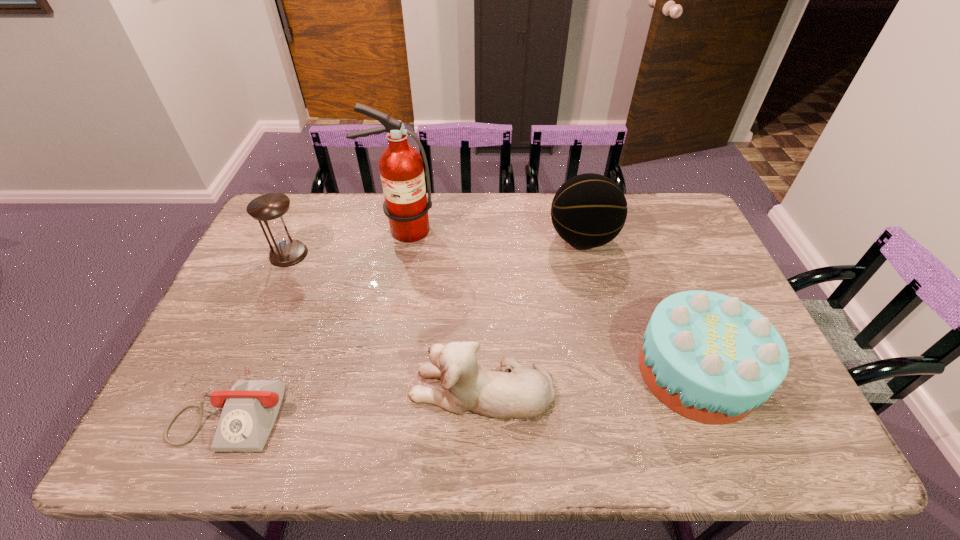
Identify the location of vacant space located on the front-facing side of the puppy. (248, 389).

You are a GUI agent. You are given a task and a screenshot of the screen. Output one action in this format:
    pyautogui.click(x=<x>, y=<y>)
    Task: Click on the free space located 0.050m on the front-facing side of the puppy
    
    Given the screenshot: What is the action you would take?
    coord(389,389)

The width and height of the screenshot is (960, 540). What are the coordinates of `vacant area situated 0.060m on the front-facing side of the puppy` in the screenshot? It's located at (385, 389).

You are a GUI agent. You are given a task and a screenshot of the screen. Output one action in this format:
    pyautogui.click(x=<x>, y=<y>)
    Task: Click on the fire extinguisher situated at the far edge
    The width and height of the screenshot is (960, 540).
    Given the screenshot: What is the action you would take?
    pyautogui.click(x=401, y=168)

Identify the location of basketball that is at the far edge. This screenshot has width=960, height=540. (589, 210).

The image size is (960, 540). I want to click on cake located at the near edge, so click(x=711, y=358).

Locate an element on the screen. Image resolution: width=960 pixels, height=540 pixels. puppy present at the near edge is located at coordinates (523, 393).

Where is `telephone located in the near edge section of the desktop`? Image resolution: width=960 pixels, height=540 pixels. telephone located in the near edge section of the desktop is located at coordinates tap(250, 408).

Identify the location of hourglass situated at the left edge. This screenshot has height=540, width=960. (270, 209).

What are the coordinates of `telephone that is positioned at the left edge` in the screenshot? It's located at (250, 408).